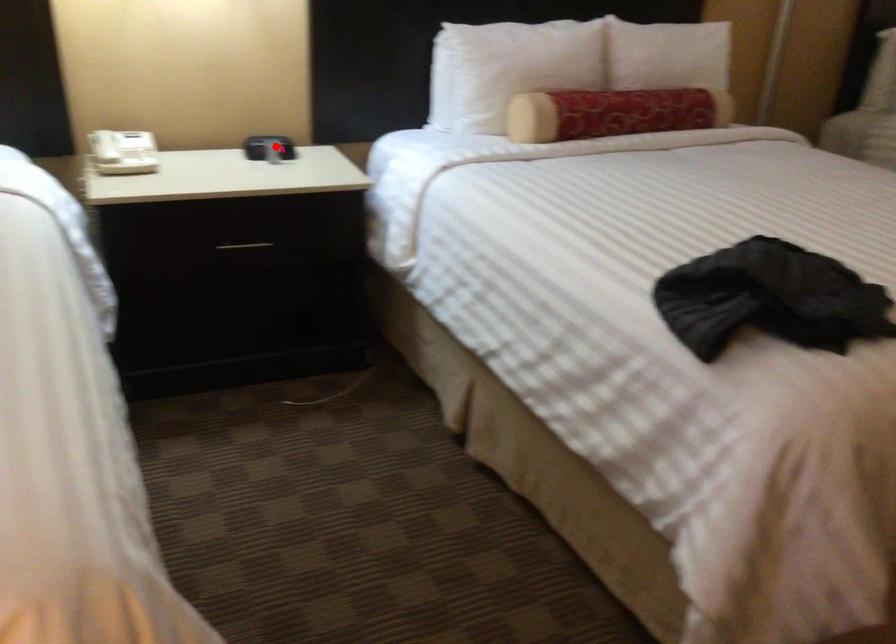
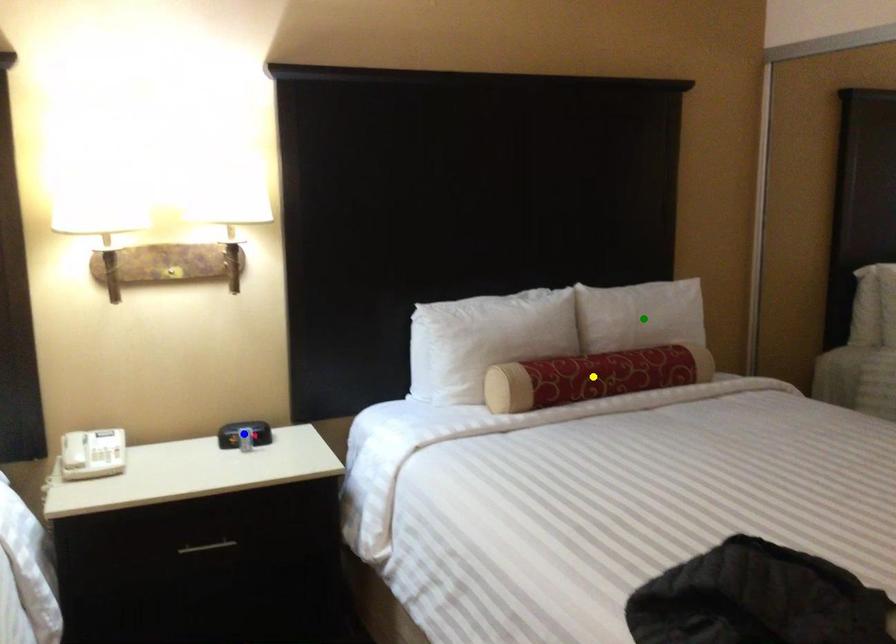
Question: I am providing you with two images of the same scene from different viewpoints. A red point is marked on the first image. You are given multiple points on the second image. Can you choose the point in image 2 that corresponds to the point in image 1?

Choices:
 (A) green point
 (B) blue point
 (C) yellow point

Answer: (B)